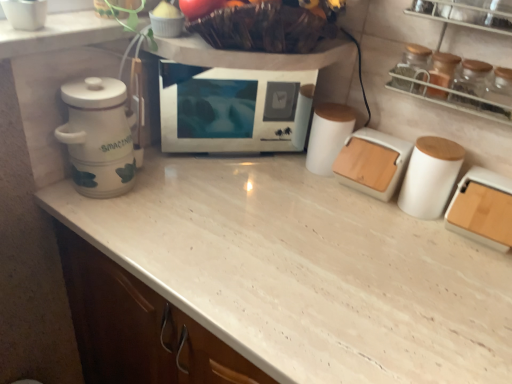
Question: Considering the relative sizes of transparent glass jars at upper right and white matte container at center in the image provided, is transparent glass jars at upper right bigger than white matte container at center?

Choices:
 (A) no
 (B) yes

Answer: (B)

Question: Is transparent glass jars at upper right to the left of white matte container at center from the viewer's perspective?

Choices:
 (A) yes
 (B) no

Answer: (B)

Question: Is transparent glass jars at upper right taller than white matte container at center?

Choices:
 (A) yes
 (B) no

Answer: (A)

Question: Does transparent glass jars at upper right lie behind white matte container at center?

Choices:
 (A) no
 (B) yes

Answer: (A)

Question: From a real-world perspective, is transparent glass jars at upper right located higher than white matte container at center?

Choices:
 (A) yes
 (B) no

Answer: (A)

Question: Does transparent glass jars at upper right come in front of white matte container at center?

Choices:
 (A) yes
 (B) no

Answer: (A)

Question: Does transparent glass jars at upper right come in front of white matte microwave oven at center?

Choices:
 (A) yes
 (B) no

Answer: (A)

Question: Does transparent glass jars at upper right come behind white matte microwave oven at center?

Choices:
 (A) yes
 (B) no

Answer: (B)

Question: Considering the relative positions of transparent glass jars at upper right and white matte microwave oven at center in the image provided, is transparent glass jars at upper right to the left of white matte microwave oven at center from the viewer's perspective?

Choices:
 (A) yes
 (B) no

Answer: (B)

Question: From the image's perspective, is transparent glass jars at upper right under white matte microwave oven at center?

Choices:
 (A) yes
 (B) no

Answer: (B)

Question: Can we say transparent glass jars at upper right lies outside white matte microwave oven at center?

Choices:
 (A) no
 (B) yes

Answer: (B)

Question: Does transparent glass jars at upper right have a lesser height compared to white matte microwave oven at center?

Choices:
 (A) no
 (B) yes

Answer: (B)

Question: Is transparent glass jars at upper right looking in the opposite direction of transparent glass jar at upper right?

Choices:
 (A) no
 (B) yes

Answer: (B)